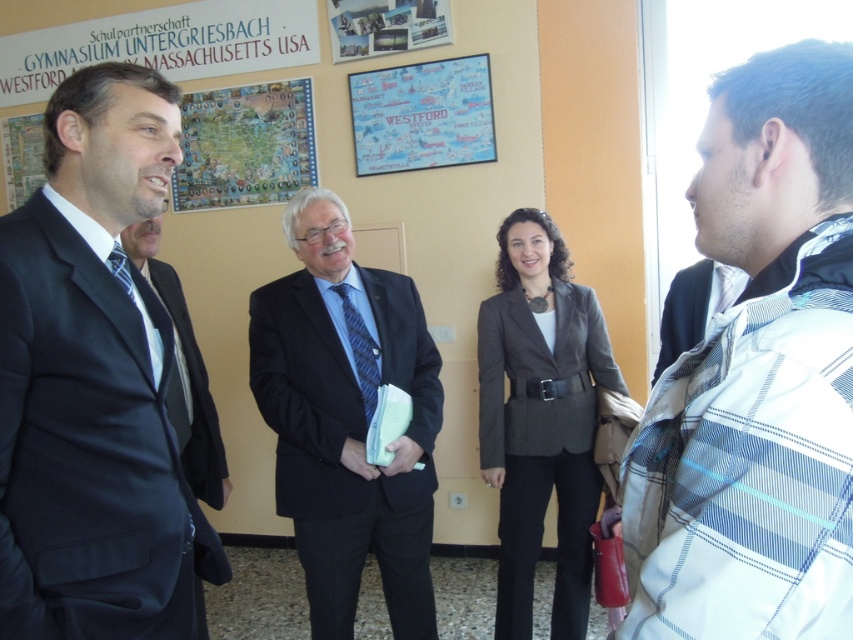
Question: Estimate the real-world distances between objects in this image. Which object is closer to the matte paper map at upper center?

Choices:
 (A) matte black suit at left
 (B) white plaid jacket at right
 (C) dark blue fabric business suit at right

Answer: (C)

Question: Which of the following is the closest to the observer?

Choices:
 (A) (223, 131)
 (B) (660, 332)

Answer: (B)

Question: Which object appears closest to the camera in this image?

Choices:
 (A) white plaid jacket at right
 (B) matte black suit at left
 (C) dark blue fabric business suit at right
 (D) matte paper map at upper center

Answer: (A)

Question: Is the position of matte black suit at center more distant than that of map paper at upper center?

Choices:
 (A) yes
 (B) no

Answer: (B)

Question: Does matte black suit at center have a smaller size compared to black matte suit at left?

Choices:
 (A) no
 (B) yes

Answer: (A)

Question: Can you confirm if matte paper map at upper center is bigger than dark blue fabric business suit at right?

Choices:
 (A) yes
 (B) no

Answer: (A)